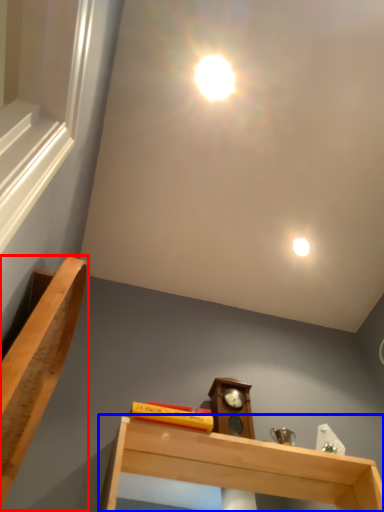
Question: Which of the following is the closest to the observer, furniture (highlighted by a red box) or shelf (highlighted by a blue box)?

Choices:
 (A) furniture
 (B) shelf

Answer: (A)